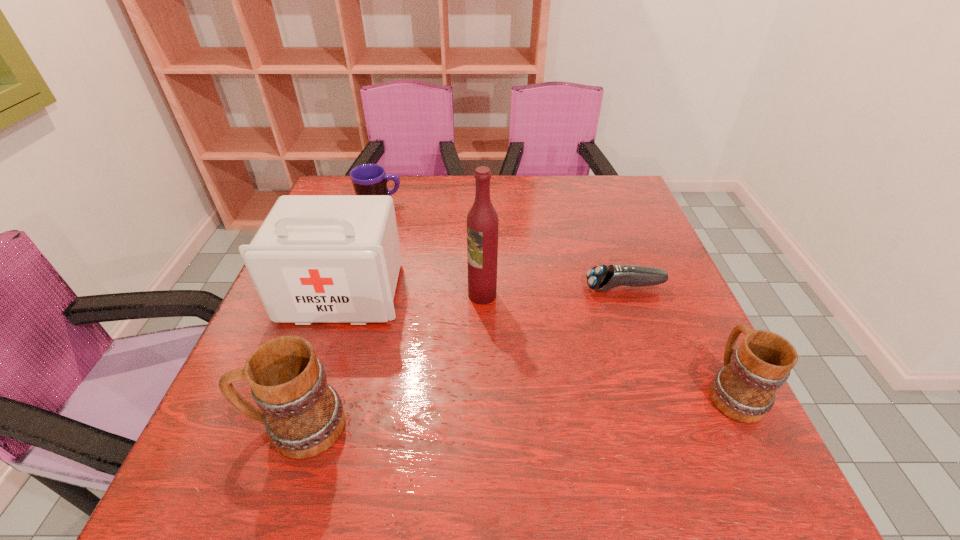
Identify the location of object located in the far edge section of the desktop. (368, 179).

Where is `the first-aid kit present at the left edge`? This screenshot has width=960, height=540. the first-aid kit present at the left edge is located at coordinates (316, 258).

Where is `mug that is positioned at the right edge`? This screenshot has height=540, width=960. mug that is positioned at the right edge is located at coordinates (744, 389).

Locate an element on the screen. This screenshot has width=960, height=540. electric shaver at the right edge is located at coordinates (602, 278).

Locate an element on the screen. object that is at the far left corner is located at coordinates (368, 179).

Image resolution: width=960 pixels, height=540 pixels. In order to click on object that is positioned at the near left corner in this screenshot , I will do `click(303, 415)`.

Where is `object present at the near right corner`? The width and height of the screenshot is (960, 540). object present at the near right corner is located at coordinates (744, 389).

Identify the location of free point at the far edge. This screenshot has width=960, height=540. (452, 209).

In the image, there is a desktop. Where is `vacant space at the right edge`? vacant space at the right edge is located at coordinates (640, 361).

This screenshot has height=540, width=960. Find the location of `vacant area at the far left corner of the desktop`. vacant area at the far left corner of the desktop is located at coordinates (338, 177).